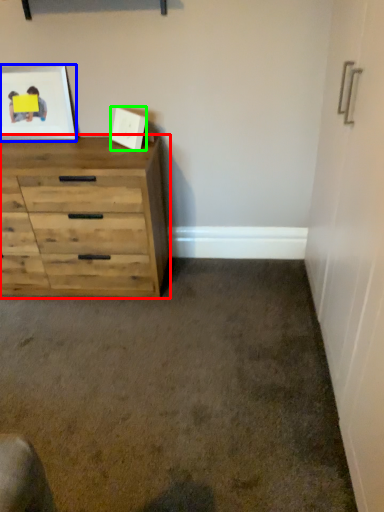
Question: Based on their relative distances, which object is nearer to chest of drawers (highlighted by a red box)? Choose from picture frame (highlighted by a blue box) and picture frame (highlighted by a green box).

Choices:
 (A) picture frame
 (B) picture frame

Answer: (A)